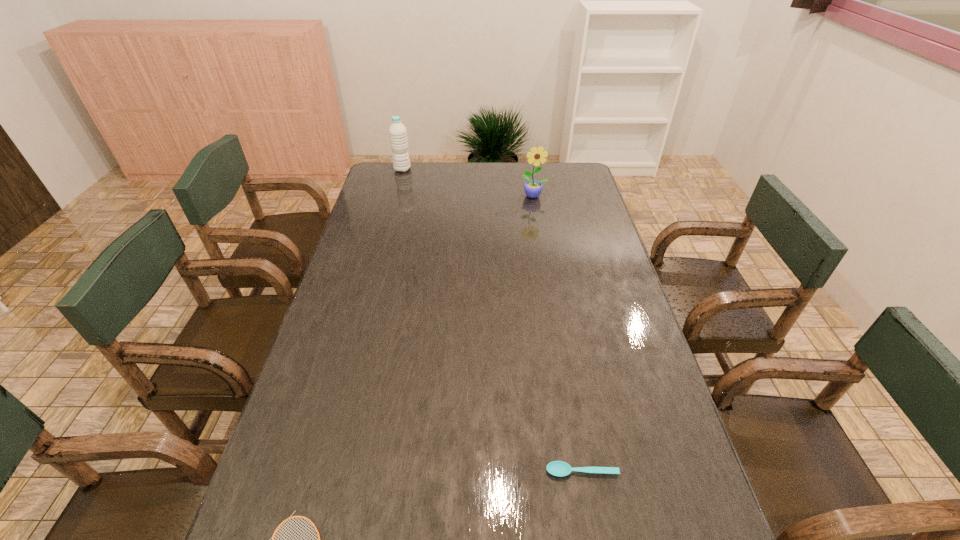
Locate an element on the screen. object at the far left corner is located at coordinates (397, 131).

In the image, there is a desktop. Identify the location of vacant area at the left edge. (348, 349).

In the image, there is a desktop. What are the coordinates of `free space at the right edge` in the screenshot? It's located at (676, 426).

Identify the location of vacant space at the far left corner. (376, 174).

You are a GUI agent. You are given a task and a screenshot of the screen. Output one action in this format:
    pyautogui.click(x=<x>, y=<y>)
    Task: Click on the free space between the third tallest object and the sunflower
    Image resolution: width=960 pixels, height=540 pixels.
    Given the screenshot: What is the action you would take?
    pyautogui.click(x=558, y=334)

Where is `free point between the farthest object and the spoon`? free point between the farthest object and the spoon is located at coordinates (492, 320).

This screenshot has height=540, width=960. I want to click on free space between the third nearest object and the second nearest object, so click(x=558, y=334).

Locate an element on the screen. The width and height of the screenshot is (960, 540). unoccupied area between the second nearest object and the water bottle is located at coordinates (492, 320).

Locate which object ranks third in proximity to the spoon. Please provide its 2D coordinates. Your answer should be formatted as a tuple, i.e. [(x, y)], where the tuple contains the x and y coordinates of a point satisfying the conditions above.

[(397, 131)]

You are a GUI agent. You are given a task and a screenshot of the screen. Output one action in this format:
    pyautogui.click(x=<x>, y=<y>)
    Task: Click on the object that is the second closest one to the spoon
    Image resolution: width=960 pixels, height=540 pixels.
    Given the screenshot: What is the action you would take?
    pyautogui.click(x=533, y=188)